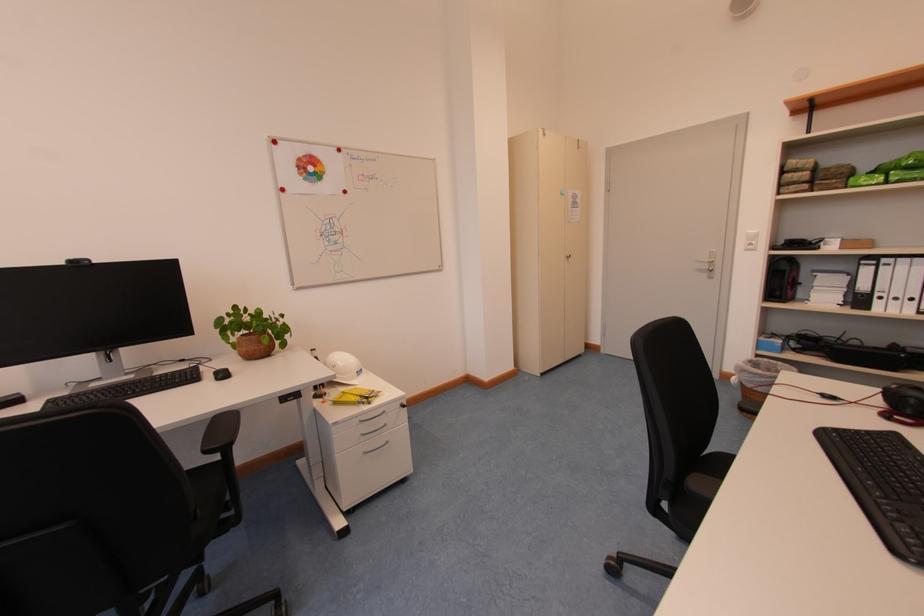
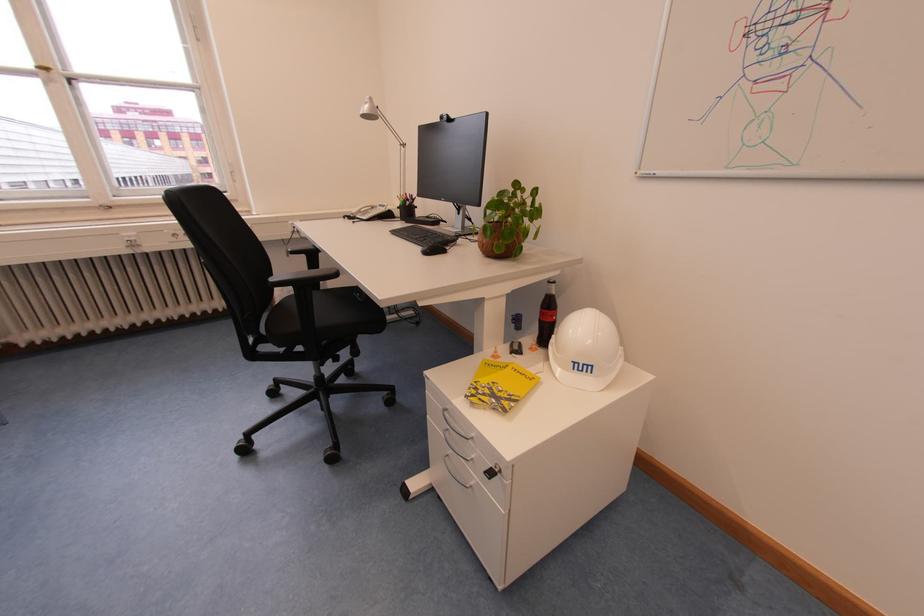
In the second image, find the point that corresponds to point 299,400 in the first image.

(367, 298)